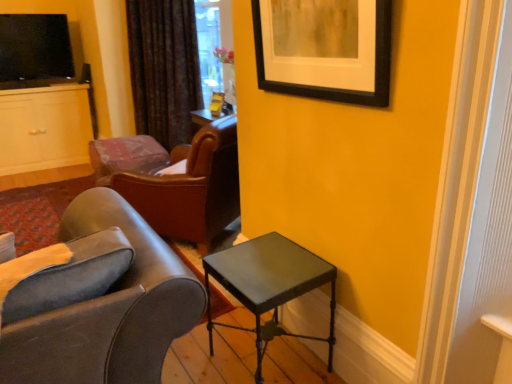
Question: Considering the relative sizes of black matte picture frame at upper right and velvet dark brown curtain at upper center in the image provided, is black matte picture frame at upper right thinner than velvet dark brown curtain at upper center?

Choices:
 (A) no
 (B) yes

Answer: (B)

Question: From the image's perspective, is black matte picture frame at upper right located above velvet dark brown curtain at upper center?

Choices:
 (A) no
 (B) yes

Answer: (A)

Question: Is black matte picture frame at upper right far from velvet dark brown curtain at upper center?

Choices:
 (A) yes
 (B) no

Answer: (A)

Question: Can you confirm if black matte picture frame at upper right is wider than velvet dark brown curtain at upper center?

Choices:
 (A) no
 (B) yes

Answer: (A)

Question: Is black matte picture frame at upper right facing towards velvet dark brown curtain at upper center?

Choices:
 (A) no
 (B) yes

Answer: (A)

Question: Visually, is black matte picture frame at upper right positioned to the left or to the right of leather at center, marked as the first chair in a back-to-front arrangement?

Choices:
 (A) left
 (B) right

Answer: (B)

Question: From a real-world perspective, relative to leather at center, marked as the first chair in a back-to-front arrangement, is black matte picture frame at upper right vertically above or below?

Choices:
 (A) below
 (B) above

Answer: (B)

Question: In terms of size, does black matte picture frame at upper right appear bigger or smaller than leather at center, marked as the first chair in a back-to-front arrangement?

Choices:
 (A) big
 (B) small

Answer: (B)

Question: Relative to leather at center, acting as the 2th chair starting from the front, is black matte picture frame at upper right in front or behind?

Choices:
 (A) behind
 (B) front

Answer: (B)

Question: Is point (330, 350) closer or farther from the camera than point (25, 51)?

Choices:
 (A) farther
 (B) closer

Answer: (B)

Question: From a real-world perspective, is metallic gray table at lower right positioned above or below matte white cabinet at left?

Choices:
 (A) below
 (B) above

Answer: (A)

Question: From the image's perspective, is metallic gray table at lower right located above or below matte white cabinet at left?

Choices:
 (A) above
 (B) below

Answer: (B)

Question: Which is correct: metallic gray table at lower right is inside matte white cabinet at left, or outside of it?

Choices:
 (A) outside
 (B) inside

Answer: (A)

Question: Considering their positions, is black matte picture frame at upper right located in front of or behind velvet dark brown curtain at upper center?

Choices:
 (A) front
 (B) behind

Answer: (A)

Question: In terms of height, does black matte picture frame at upper right look taller or shorter compared to velvet dark brown curtain at upper center?

Choices:
 (A) tall
 (B) short

Answer: (B)